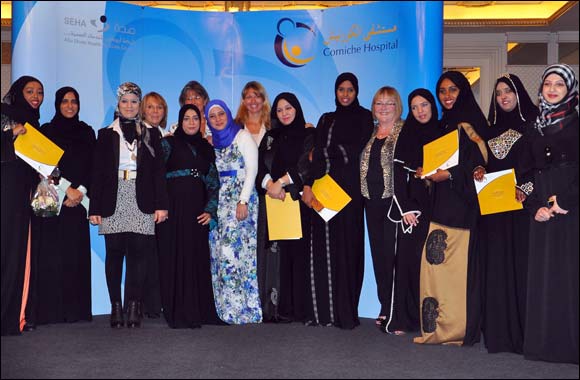
You are a GUI agent. You are given a task and a screenshot of the screen. Output one action in this format:
    pyautogui.click(x=<x>, y=<y>)
    Task: Click on the yellow lighted ceiling
    The height and width of the screenshot is (380, 580).
    Given the screenshot: What is the action you would take?
    pyautogui.click(x=494, y=9)